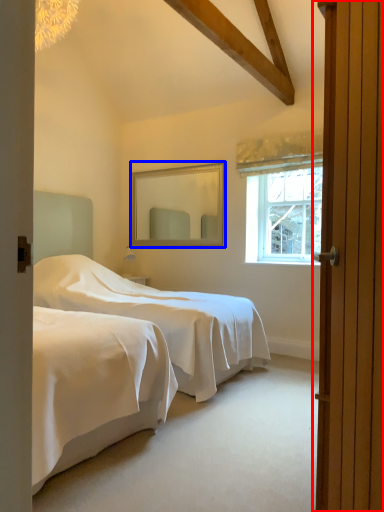
Question: Which of the following is the closest to the observer, door (highlighted by a red box) or mirror (highlighted by a blue box)?

Choices:
 (A) door
 (B) mirror

Answer: (A)